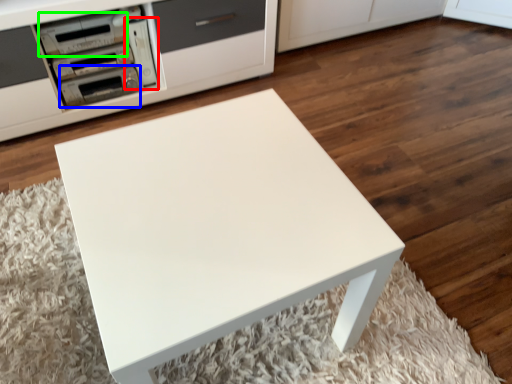
Question: Based on their relative distances, which object is nearer to appliance (highlighted by a red box)? Choose from appliance (highlighted by a blue box) and appliance (highlighted by a green box).

Choices:
 (A) appliance
 (B) appliance

Answer: (A)